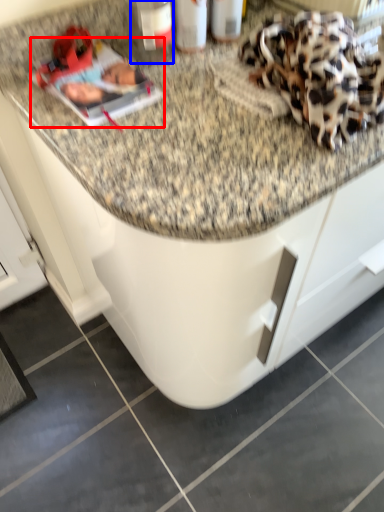
Question: Which point is closer to the camera, magazine (highlighted by a red box) or bottle (highlighted by a blue box)?

Choices:
 (A) magazine
 (B) bottle

Answer: (A)